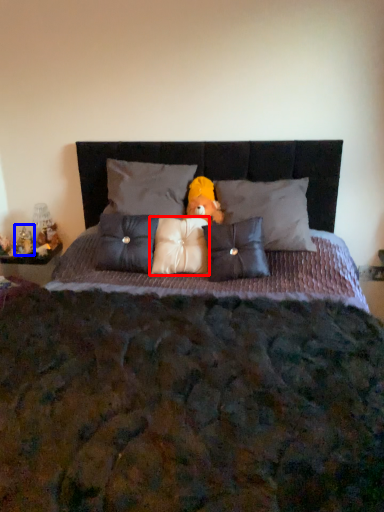
Question: Which object is closer to the camera taking this photo, pillow (highlighted by a red box) or figurine (highlighted by a blue box)?

Choices:
 (A) pillow
 (B) figurine

Answer: (A)